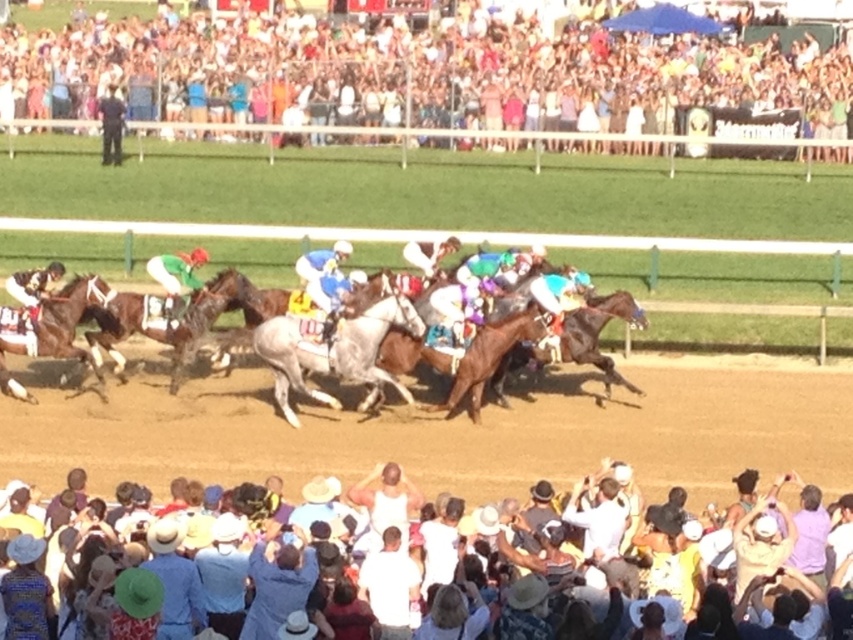
From the picture: You are a photographer standing at the edge of the racetrack. You want to take a photo of the white tank top at center without the multicolored fabric crowd at upper center blocking it. Is this possible based on their heights?

The multicolored fabric crowd at upper center is taller than white tank top at center, so it would block the view of the white tank top at center. Therefore, taking a clear photo without obstruction is not possible.

You are a photographer at the horse racing event. You want to capture a photo of the brown glossy horse at center. To ensure the horse is in the frame, where should you aim your camera?

The brown glossy horse at center is located at point 0.438 on the horizontal axis and 0.293 on the vertical axis, so aim your camera towards those coordinates to capture it.

Based on the photo, you are a photographer at the horse race and want to capture the entire crowd in one shot. The multicolored fabric crowd at upper center and the white cotton crowd at lower center are both in your viewfinder. Which crowd takes up more horizontal space in the image?

The multicolored fabric crowd at upper center takes up more horizontal space than the white cotton crowd at lower center because its width surpasses the other.